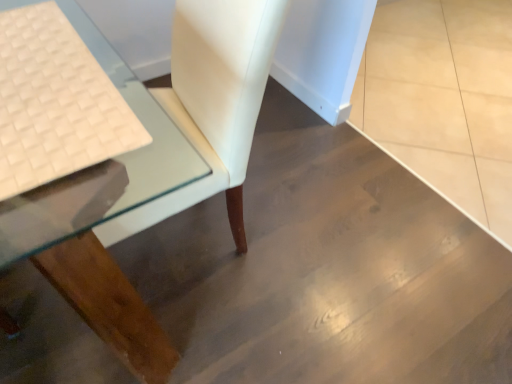
Question: From a real-world perspective, is white woven fabric at left under clear glass table at lower left?

Choices:
 (A) no
 (B) yes

Answer: (A)

Question: Is the position of white woven fabric at left less distant than that of clear glass table at lower left?

Choices:
 (A) no
 (B) yes

Answer: (A)

Question: Is clear glass table at lower left at the back of white woven fabric at left?

Choices:
 (A) no
 (B) yes

Answer: (B)

Question: Is white woven fabric at left beside clear glass table at lower left?

Choices:
 (A) no
 (B) yes

Answer: (A)

Question: Considering the relative sizes of white woven fabric at left and clear glass table at lower left in the image provided, is white woven fabric at left thinner than clear glass table at lower left?

Choices:
 (A) yes
 (B) no

Answer: (A)

Question: Can you confirm if white woven fabric at left is smaller than clear glass table at lower left?

Choices:
 (A) yes
 (B) no

Answer: (A)

Question: Is clear glass table at lower left far from white woven fabric at left?

Choices:
 (A) yes
 (B) no

Answer: (B)

Question: Is the position of clear glass table at lower left less distant than that of white woven fabric at left?

Choices:
 (A) no
 (B) yes

Answer: (B)

Question: Would you say white woven fabric at left is part of clear glass table at lower left's contents?

Choices:
 (A) no
 (B) yes

Answer: (B)

Question: Is clear glass table at lower left wider than white woven fabric at left?

Choices:
 (A) yes
 (B) no

Answer: (A)

Question: Is clear glass table at lower left located outside white woven fabric at left?

Choices:
 (A) no
 (B) yes

Answer: (B)

Question: Does clear glass table at lower left have a larger size compared to white woven fabric at left?

Choices:
 (A) no
 (B) yes

Answer: (B)

Question: From the image's perspective, is clear glass table at lower left positioned above or below white woven fabric at left?

Choices:
 (A) above
 (B) below

Answer: (A)